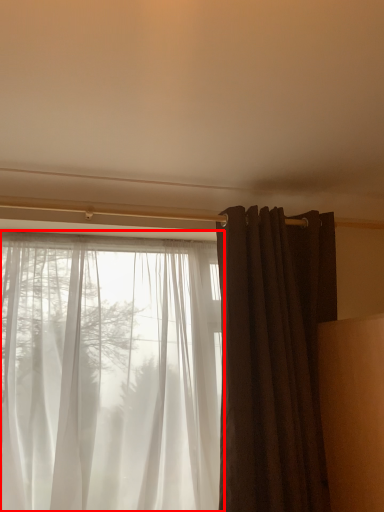
Question: From the image's perspective, considering the relative positions of curtain (annotated by the red box) and curtain in the image provided, where is curtain (annotated by the red box) located with respect to the staircase?

Choices:
 (A) above
 (B) below

Answer: (B)